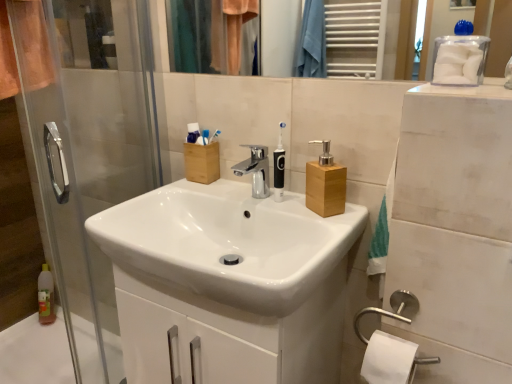
Question: Is clear plastic bottle at lower left turned away from black plastic toothbrush at upper center, marked as the 3th toothbrush in a front-to-back arrangement?

Choices:
 (A) yes
 (B) no

Answer: (B)

Question: Can you confirm if clear plastic bottle at lower left is taller than black plastic toothbrush at upper center, positioned as the second toothbrush in left-to-right order?

Choices:
 (A) yes
 (B) no

Answer: (A)

Question: Does clear plastic bottle at lower left have a lesser width compared to black plastic toothbrush at upper center, which is the 1th toothbrush from back to front?

Choices:
 (A) yes
 (B) no

Answer: (B)

Question: Can you confirm if clear plastic bottle at lower left is positioned to the right of black plastic toothbrush at upper center, arranged as the second toothbrush when viewed from the right?

Choices:
 (A) no
 (B) yes

Answer: (A)

Question: From a real-world perspective, is clear plastic bottle at lower left physically above black plastic toothbrush at upper center, marked as the 3th toothbrush in a front-to-back arrangement?

Choices:
 (A) yes
 (B) no

Answer: (B)

Question: Is clear plastic bottle at lower left with black plastic toothbrush at upper center, positioned as the second toothbrush in left-to-right order?

Choices:
 (A) no
 (B) yes

Answer: (A)

Question: Could you tell me if white plastic toothbrush at upper center, the 1th toothbrush positioned from the left, is turned towards clear plastic bottle at lower left?

Choices:
 (A) yes
 (B) no

Answer: (B)

Question: Does white plastic toothbrush at upper center, which appears as the 2th toothbrush when viewed from the back, lie in front of clear plastic bottle at lower left?

Choices:
 (A) yes
 (B) no

Answer: (A)

Question: Is white plastic toothbrush at upper center, which appears as the 2th toothbrush when viewed from the back, taller than clear plastic bottle at lower left?

Choices:
 (A) yes
 (B) no

Answer: (B)

Question: Is white plastic toothbrush at upper center, placed as the 3th toothbrush when sorted from right to left, outside of clear plastic bottle at lower left?

Choices:
 (A) no
 (B) yes

Answer: (B)

Question: Is white plastic toothbrush at upper center, the 1th toothbrush positioned from the left, surrounding clear plastic bottle at lower left?

Choices:
 (A) no
 (B) yes

Answer: (A)

Question: Considering the relative sizes of white plastic toothbrush at upper center, the second toothbrush viewed from the front, and clear plastic bottle at lower left in the image provided, is white plastic toothbrush at upper center, the second toothbrush viewed from the front, smaller than clear plastic bottle at lower left?

Choices:
 (A) yes
 (B) no

Answer: (A)

Question: Is clear plastic bottle at lower left at the right side of white plastic toothbrush at upper center, the second toothbrush viewed from the front?

Choices:
 (A) yes
 (B) no

Answer: (B)